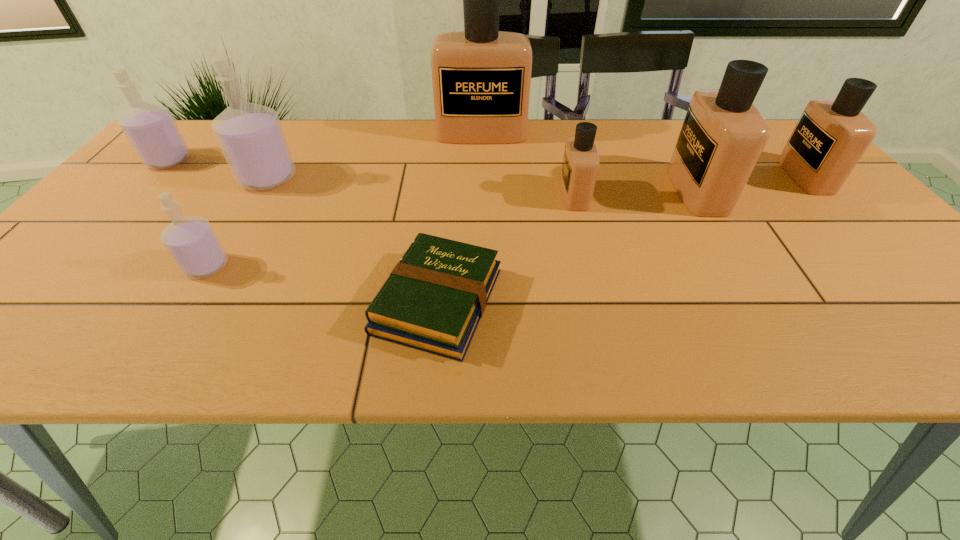
Where is `object that is at the left edge`? The width and height of the screenshot is (960, 540). object that is at the left edge is located at coordinates (150, 129).

Where is `object present at the right edge`? The image size is (960, 540). object present at the right edge is located at coordinates (831, 136).

Identify the location of object that is at the far left corner. The width and height of the screenshot is (960, 540). (150, 129).

At what (x,y) coordinates should I click in order to perform the action: click on object at the far right corner. Please return your answer as a coordinate pair (x, y). The image size is (960, 540). Looking at the image, I should click on (831, 136).

The height and width of the screenshot is (540, 960). What are the coordinates of `free space at the far edge of the desktop` in the screenshot? It's located at (435, 155).

Find the location of a particular element. The image size is (960, 540). vacant space at the near edge of the desktop is located at coordinates (126, 324).

This screenshot has width=960, height=540. Find the location of `vacant region at the left edge`. vacant region at the left edge is located at coordinates (132, 254).

Where is `blank space at the right edge of the desktop`? blank space at the right edge of the desktop is located at coordinates (874, 295).

In the image, there is a desktop. Identify the location of free region at the far left corner. The height and width of the screenshot is (540, 960). (204, 154).

Image resolution: width=960 pixels, height=540 pixels. In order to click on vacant area that lies between the farthest object and the book in this screenshot , I will do `click(460, 217)`.